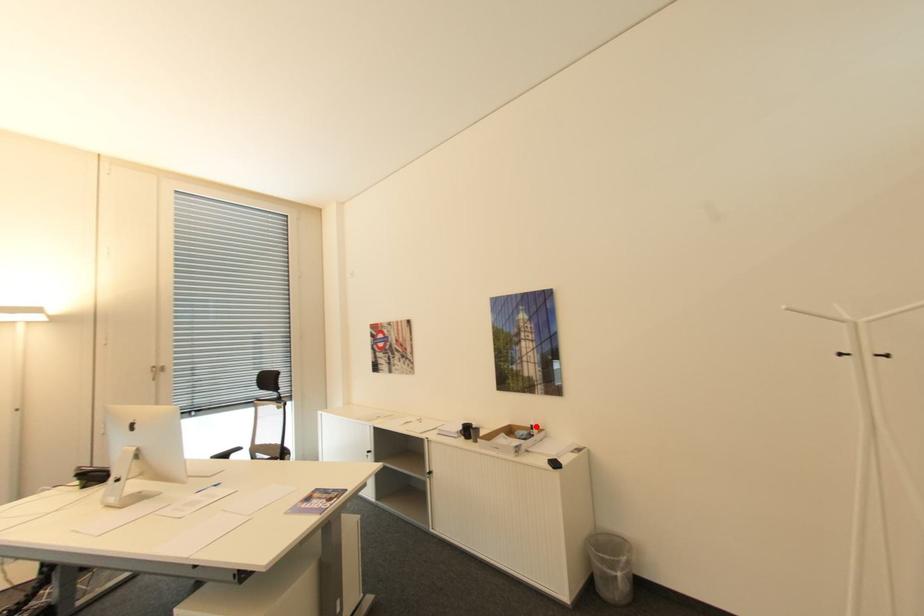
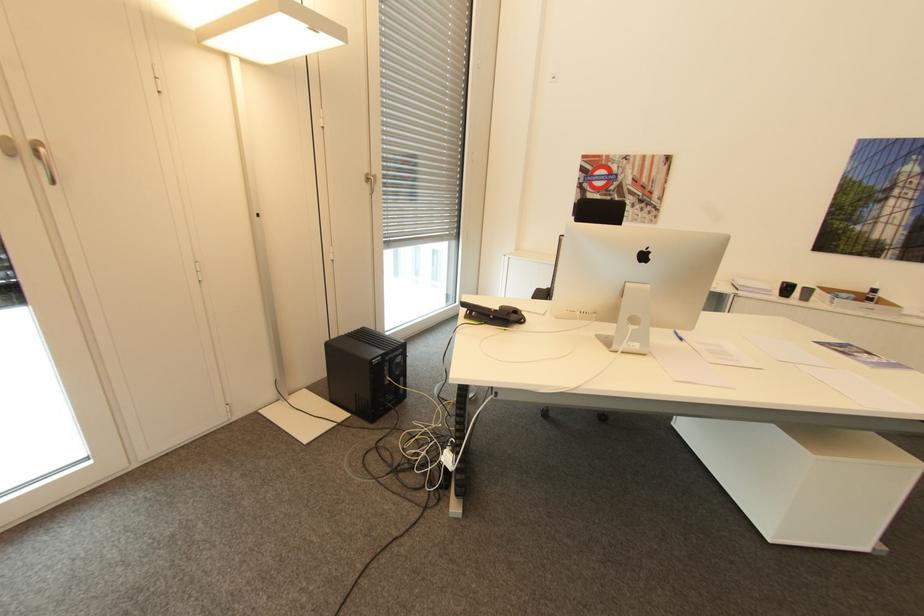
Find the pixel in the second image that matches the highlighted location in the first image.

(879, 290)